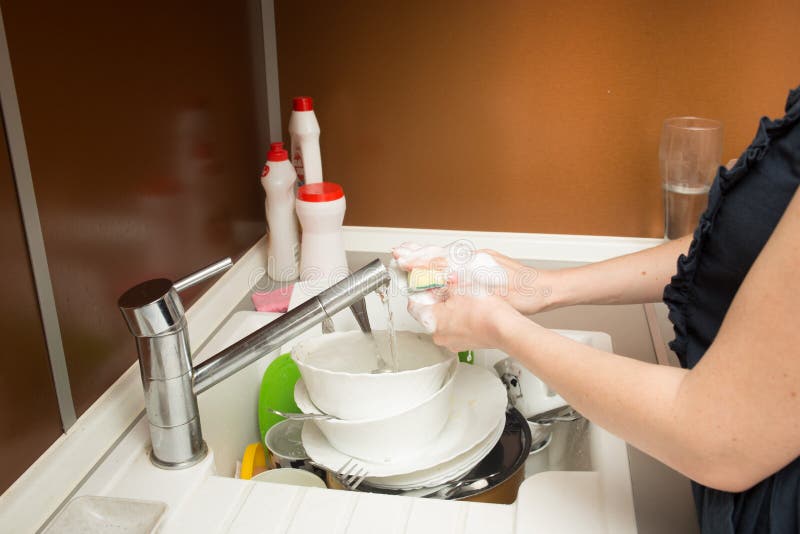
Where is `cups`? The height and width of the screenshot is (534, 800). cups is located at coordinates (281, 394), (298, 479), (526, 389), (698, 160).